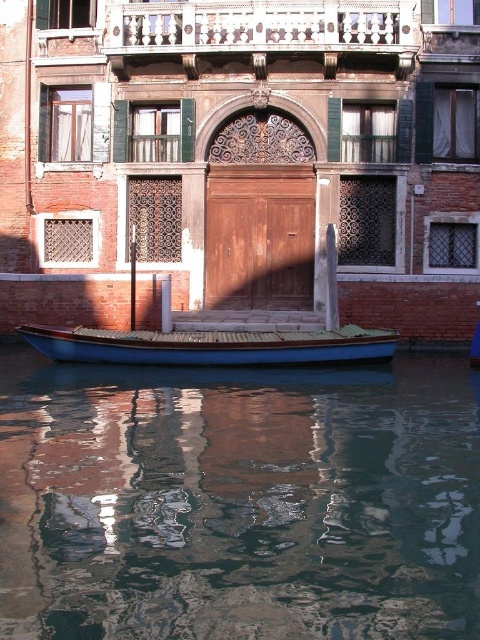
Which is behind, point (180, 492) or point (33, 337)?

The point (33, 337) is more distant.

Between smooth glass water at lower center and blue polished wood boat at center, which one is positioned lower?

smooth glass water at lower center is lower down.

Does point (380, 387) come closer to viewer compared to point (90, 333)?

Yes, it is in front of point (90, 333).

Where is `smooth glass water at lower center`? smooth glass water at lower center is located at coordinates (239, 500).